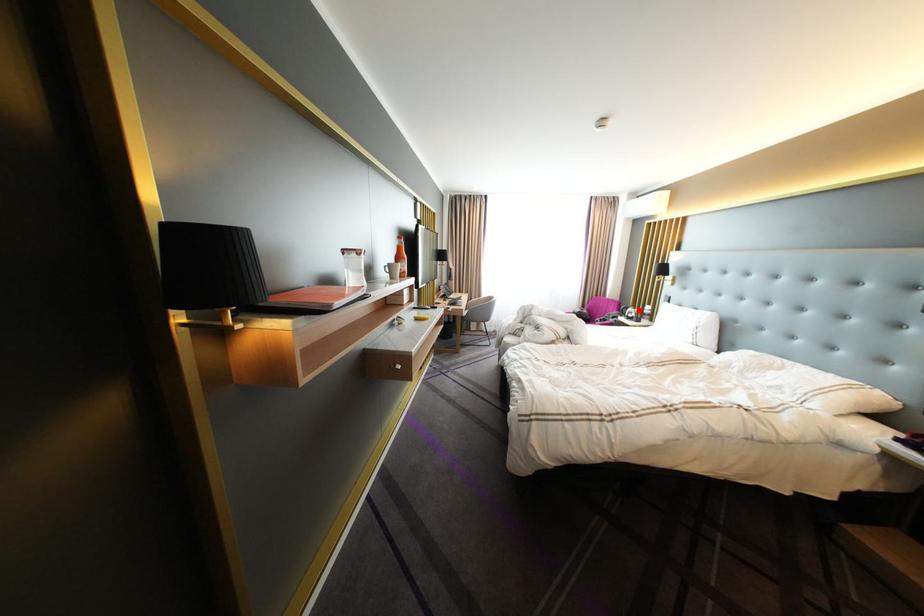
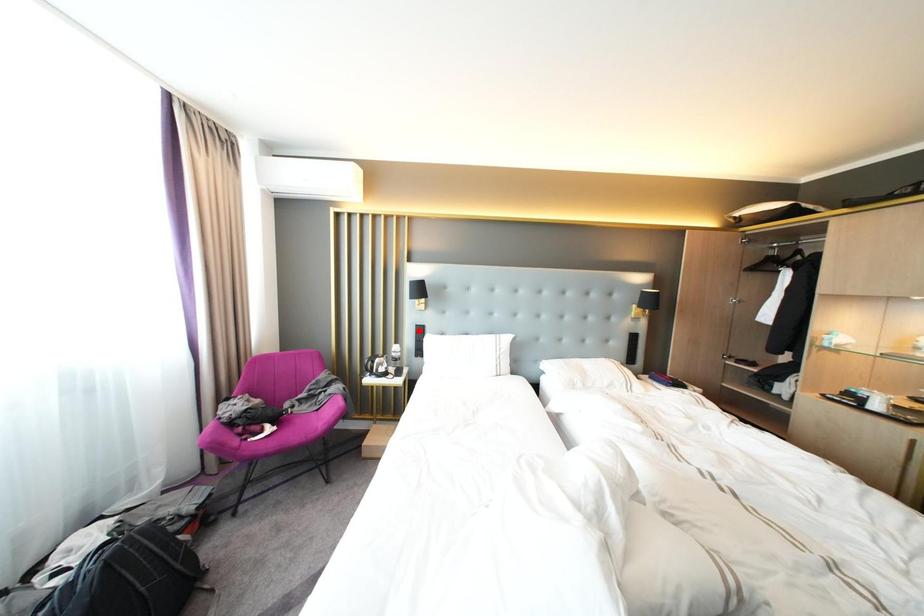
I am providing you with two images of the same scene from different viewpoints. A red point is marked on the first image and another point is marked on the second image. Is the red point in image1 aligned with the point shown in image2?

No